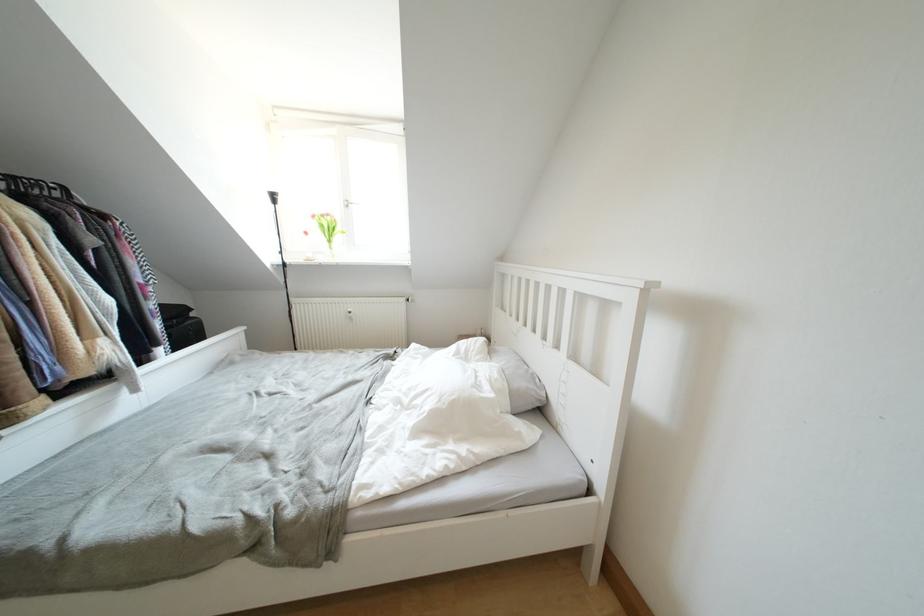
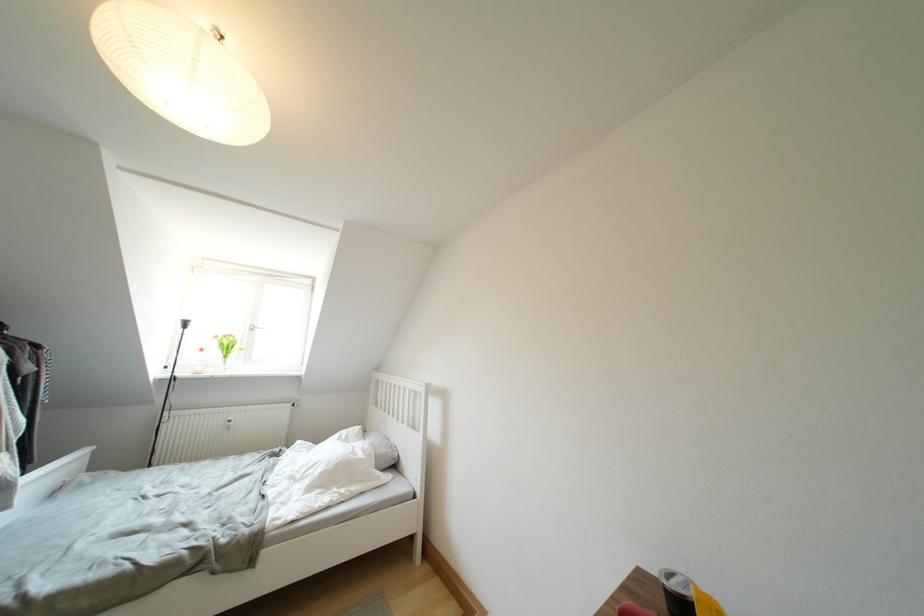
Locate, in the second image, the point that corresponds to the point at 319,220 in the first image.

(222, 341)